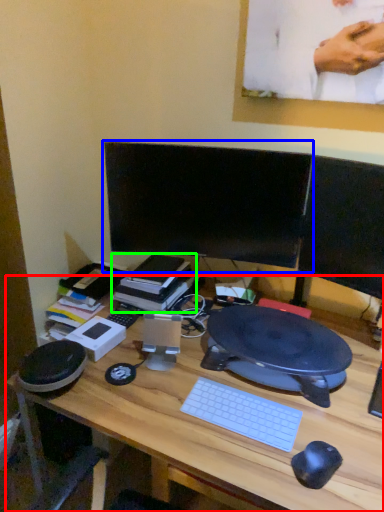
Question: Which object is positioned farthest from desk (highlighted by a red box)? Select from computer monitor (highlighted by a blue box) and book (highlighted by a green box).

Choices:
 (A) computer monitor
 (B) book

Answer: (A)